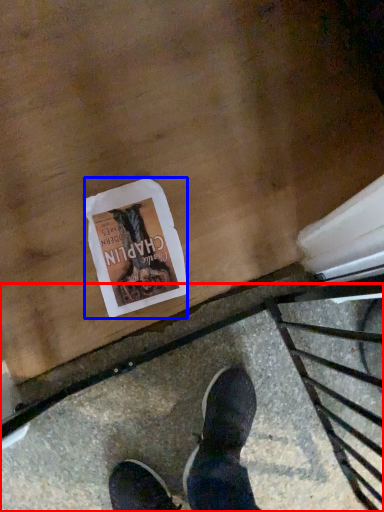
Question: Which object appears closest to the camera in this image, pavement (highlighted by a red box) or flyer (highlighted by a blue box)?

Choices:
 (A) pavement
 (B) flyer

Answer: (A)